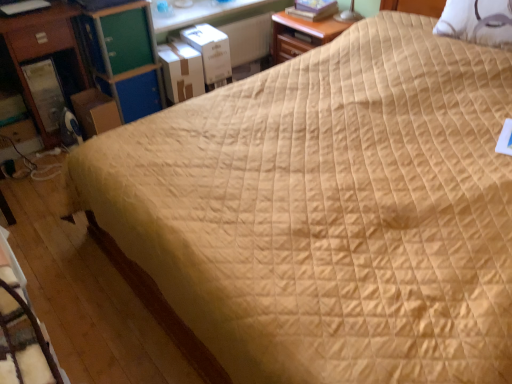
What do you see at coordinates (42, 54) in the screenshot?
I see `matte wood nightstand at left, which is counted as the second nightstand, starting from the right` at bounding box center [42, 54].

How much space does white cardboard box at upper left, arranged as the second cardboard box when viewed from the right, occupy vertically?

It is 10.78 inches.

Where is `green wood drawer at upper left`? This screenshot has height=384, width=512. green wood drawer at upper left is located at coordinates (127, 40).

Describe the element at coordinates (127, 40) in the screenshot. I see `green wood drawer at upper left` at that location.

What is the approximate width of matte wood nightstand at upper center, acting as the 1th nightstand starting from the right?

matte wood nightstand at upper center, acting as the 1th nightstand starting from the right, is 47.10 centimeters in width.

Where is `matte wood nightstand at upper center, acting as the 1th nightstand starting from the right`? matte wood nightstand at upper center, acting as the 1th nightstand starting from the right is located at coordinates (301, 35).

The width and height of the screenshot is (512, 384). What are the coordinates of `velvet brown rocking chair at lower left` in the screenshot? It's located at (23, 341).

In the scene shown: Is green plastic file cabinet at upper left located within matte wood nightstand at upper center, acting as the 1th nightstand starting from the right?

No, green plastic file cabinet at upper left is not surrounded by matte wood nightstand at upper center, acting as the 1th nightstand starting from the right.

Relative to green plastic file cabinet at upper left, is matte wood nightstand at upper center, the 2th nightstand in the left-to-right sequence, in front or behind?

matte wood nightstand at upper center, the 2th nightstand in the left-to-right sequence, is behind green plastic file cabinet at upper left.

I want to click on the 2nd nightstand below the green plastic file cabinet at upper left (from a real-world perspective), so click(301, 35).

How different are the orientations of matte wood nightstand at upper center, the 2th nightstand in the left-to-right sequence, and green plastic file cabinet at upper left in degrees?

The angle between the facing direction of matte wood nightstand at upper center, the 2th nightstand in the left-to-right sequence, and the facing direction of green plastic file cabinet at upper left is 93.7 degrees.

Is point (172, 78) closer to camera compared to point (89, 15)?

No, it is behind (89, 15).

The image size is (512, 384). I want to click on cardboard box that is the 2nd object located behind the green plastic file cabinet at upper left, so click(181, 71).

Consider the image. Considering the sizes of white cardboard box at upper left, the 2th cardboard box in the left-to-right sequence, and green plastic file cabinet at upper left in the image, is white cardboard box at upper left, the 2th cardboard box in the left-to-right sequence, wider or thinner than green plastic file cabinet at upper left?

Clearly, white cardboard box at upper left, the 2th cardboard box in the left-to-right sequence, has less width compared to green plastic file cabinet at upper left.

Is white cardboard box at upper left, the 2th cardboard box in the left-to-right sequence, positioned far away from brown cardboard box at left, which ranks as the 3th cardboard box in right-to-left order?

white cardboard box at upper left, the 2th cardboard box in the left-to-right sequence, is actually quite close to brown cardboard box at left, which ranks as the 3th cardboard box in right-to-left order.

Is white cardboard box at upper left, arranged as the second cardboard box when viewed from the right, not within brown cardboard box at left, which is the first cardboard box in left-to-right order?

white cardboard box at upper left, arranged as the second cardboard box when viewed from the right, lies outside brown cardboard box at left, which is the first cardboard box in left-to-right order,'s area.

From a real-world perspective, which is physically below, white cardboard box at upper left, arranged as the second cardboard box when viewed from the right, or brown cardboard box at left, which is the first cardboard box in left-to-right order?

In real-world perspective, brown cardboard box at left, which is the first cardboard box in left-to-right order, is lower.

Considering the relative positions of white cardboard box at upper left, arranged as the second cardboard box when viewed from the right, and brown cardboard box at left, which ranks as the 3th cardboard box in right-to-left order, in the image provided, is white cardboard box at upper left, arranged as the second cardboard box when viewed from the right, behind brown cardboard box at left, which ranks as the 3th cardboard box in right-to-left order,?

Yes, white cardboard box at upper left, arranged as the second cardboard box when viewed from the right, is behind brown cardboard box at left, which ranks as the 3th cardboard box in right-to-left order.

What's the angular difference between white cardboard box at upper center, which appears as the 3th cardboard box when viewed from the left, and brown cardboard box at left, which ranks as the 3th cardboard box in right-to-left order,'s facing directions?

6.91 degrees.

Is white cardboard box at upper center, which is the 1th cardboard box in right-to-left order, to the left or to the right of brown cardboard box at left, which is the first cardboard box in left-to-right order, in the image?

Based on their positions, white cardboard box at upper center, which is the 1th cardboard box in right-to-left order, is located to the right of brown cardboard box at left, which is the first cardboard box in left-to-right order.

Can you see white cardboard box at upper center, which is the 1th cardboard box in right-to-left order, touching brown cardboard box at left, which is the first cardboard box in left-to-right order?

No, white cardboard box at upper center, which is the 1th cardboard box in right-to-left order, is not with brown cardboard box at left, which is the first cardboard box in left-to-right order.

Is white cardboard box at upper center, which is the 1th cardboard box in right-to-left order, facing away from brown cardboard box at left, which ranks as the 3th cardboard box in right-to-left order?

white cardboard box at upper center, which is the 1th cardboard box in right-to-left order, does not have its back to brown cardboard box at left, which ranks as the 3th cardboard box in right-to-left order.

Which point is more forward, (205,29) or (100,37)?

The point (100,37) is closer to the camera.

You are a GUI agent. You are given a task and a screenshot of the screen. Output one action in this format:
    pyautogui.click(x=<x>, y=<y>)
    Task: Click on the file cabinet in front of the white cardboard box at upper center, which appears as the 3th cardboard box when viewed from the left
    The height and width of the screenshot is (384, 512).
    Given the screenshot: What is the action you would take?
    pyautogui.click(x=125, y=58)

From the image's perspective, which is above, white cardboard box at upper center, which appears as the 3th cardboard box when viewed from the left, or green plastic file cabinet at upper left?

white cardboard box at upper center, which appears as the 3th cardboard box when viewed from the left, is shown above in the image.

Consider the image. From a real-world perspective, does white cardboard box at upper center, which is the 1th cardboard box in right-to-left order, sit lower than green plastic file cabinet at upper left?

Indeed, from a real-world perspective, white cardboard box at upper center, which is the 1th cardboard box in right-to-left order, is positioned beneath green plastic file cabinet at upper left.

Between matte wood nightstand at upper center, acting as the 1th nightstand starting from the right, and brown cardboard box at left, which is the first cardboard box in left-to-right order, which one has more height?

matte wood nightstand at upper center, acting as the 1th nightstand starting from the right, is taller.

Do you think matte wood nightstand at upper center, acting as the 1th nightstand starting from the right, is within brown cardboard box at left, which is the first cardboard box in left-to-right order, or outside of it?

The correct answer is: outside.

From the picture: Is matte wood nightstand at upper center, the 2th nightstand in the left-to-right sequence, to the left of brown cardboard box at left, which ranks as the 3th cardboard box in right-to-left order, from the viewer's perspective?

No.

The width and height of the screenshot is (512, 384). Identify the location of the 3rd cardboard box counting from the left side of the matte wood nightstand at upper center, acting as the 1th nightstand starting from the right. (95, 112).

Considering the sizes of objects brown cardboard box at left, which is the first cardboard box in left-to-right order, and matte wood nightstand at left, which is counted as the 1th nightstand, starting from the left, in the image provided, who is shorter, brown cardboard box at left, which is the first cardboard box in left-to-right order, or matte wood nightstand at left, which is counted as the 1th nightstand, starting from the left,?

brown cardboard box at left, which is the first cardboard box in left-to-right order, is shorter.

Which is in front, point (106, 126) or point (28, 24)?

The point (28, 24) is closer to the camera.

From the image's perspective, is brown cardboard box at left, which ranks as the 3th cardboard box in right-to-left order, on matte wood nightstand at left, which is counted as the second nightstand, starting from the right?

No, from the image's perspective, brown cardboard box at left, which ranks as the 3th cardboard box in right-to-left order, is not over matte wood nightstand at left, which is counted as the second nightstand, starting from the right.

Is brown cardboard box at left, which is the first cardboard box in left-to-right order, beside matte wood nightstand at left, which is counted as the 1th nightstand, starting from the left?

No, brown cardboard box at left, which is the first cardboard box in left-to-right order, is not beside matte wood nightstand at left, which is counted as the 1th nightstand, starting from the left.

From a real-world perspective, starting from the green plastic file cabinet at upper left, which nightstand is the 2nd one below it? Please provide its 2D coordinates.

[(301, 35)]

From the green plastic file cabinet at upper left, count 1st cardboard box to the right and point to it. Please provide its 2D coordinates.

[(181, 71)]

Which object lies further to the anchor point matte wood nightstand at left, which is counted as the 1th nightstand, starting from the left, green wood drawer at upper left or green plastic file cabinet at upper left?

Based on the image, green wood drawer at upper left appears to be further to matte wood nightstand at left, which is counted as the 1th nightstand, starting from the left.

Estimate the real-world distances between objects in this image. Which object is further from white cardboard box at upper center, which is the 1th cardboard box in right-to-left order, brown cardboard box at left, which ranks as the 3th cardboard box in right-to-left order, or green plastic file cabinet at upper left?

brown cardboard box at left, which ranks as the 3th cardboard box in right-to-left order, lies further to white cardboard box at upper center, which is the 1th cardboard box in right-to-left order, than the other object.

Based on their spatial positions, is matte wood nightstand at upper center, the 2th nightstand in the left-to-right sequence, or velvet brown rocking chair at lower left further from green wood drawer at upper left?

velvet brown rocking chair at lower left is further to green wood drawer at upper left.

Based on their spatial positions, is matte wood nightstand at upper center, the 2th nightstand in the left-to-right sequence, or green plastic file cabinet at upper left further from matte wood nightstand at left, which is counted as the second nightstand, starting from the right?

matte wood nightstand at upper center, the 2th nightstand in the left-to-right sequence.

Estimate the real-world distances between objects in this image. Which object is closer to white textured pillow at upper right, brown cardboard box at left, which is the first cardboard box in left-to-right order, or green wood drawer at upper left?

green wood drawer at upper left is closer to white textured pillow at upper right.

Estimate the real-world distances between objects in this image. Which object is further from matte wood nightstand at upper center, the 2th nightstand in the left-to-right sequence, matte wood nightstand at left, which is counted as the second nightstand, starting from the right, or white textured pillow at upper right?

The object further to matte wood nightstand at upper center, the 2th nightstand in the left-to-right sequence, is matte wood nightstand at left, which is counted as the second nightstand, starting from the right.

Looking at the image, which one is located closer to white cardboard box at upper center, which appears as the 3th cardboard box when viewed from the left, matte wood nightstand at upper center, the 2th nightstand in the left-to-right sequence, or matte wood nightstand at left, which is counted as the 1th nightstand, starting from the left?

The object closer to white cardboard box at upper center, which appears as the 3th cardboard box when viewed from the left, is matte wood nightstand at upper center, the 2th nightstand in the left-to-right sequence.

Considering their positions, is white textured pillow at upper right positioned closer to white cardboard box at upper left, the 2th cardboard box in the left-to-right sequence, than matte wood nightstand at upper center, the 2th nightstand in the left-to-right sequence?

Among the two, matte wood nightstand at upper center, the 2th nightstand in the left-to-right sequence, is located nearer to white cardboard box at upper left, the 2th cardboard box in the left-to-right sequence.

Locate an element on the screen. The width and height of the screenshot is (512, 384). file cabinet between brown cardboard box at left, which is the first cardboard box in left-to-right order, and white cardboard box at upper left, the 2th cardboard box in the left-to-right sequence is located at coordinates (125, 58).

Where is `nightstand between white cardboard box at upper left, arranged as the second cardboard box when viewed from the right, and white textured pillow at upper right from left to right`? This screenshot has height=384, width=512. nightstand between white cardboard box at upper left, arranged as the second cardboard box when viewed from the right, and white textured pillow at upper right from left to right is located at coordinates (301, 35).

This screenshot has width=512, height=384. I want to click on drawer between matte wood nightstand at left, which is counted as the 1th nightstand, starting from the left, and matte wood nightstand at upper center, the 2th nightstand in the left-to-right sequence, from left to right, so click(x=127, y=40).

Locate an element on the screen. The image size is (512, 384). cardboard box located between velvet brown rocking chair at lower left and white cardboard box at upper left, arranged as the second cardboard box when viewed from the right, in the depth direction is located at coordinates (95, 112).